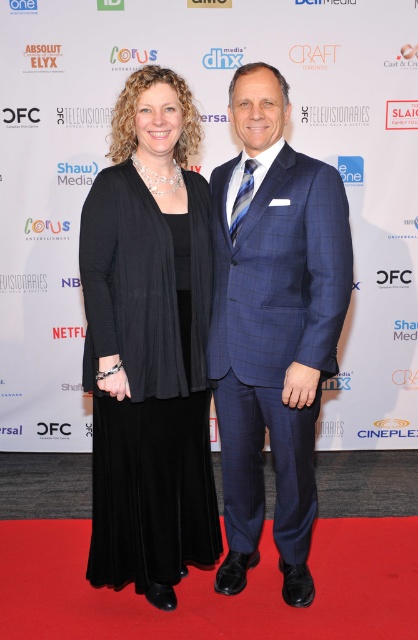
Is black matte dress at center taller than blue checkered suit at center?

Yes, black matte dress at center is taller than blue checkered suit at center.

Looking at this image, between black matte dress at center and blue checkered suit at center, which one appears on the right side from the viewer's perspective?

blue checkered suit at center

Is point (112, 353) less distant than point (318, 257)?

No, (112, 353) is behind (318, 257).

Locate an element on the screen. black matte dress at center is located at coordinates (148, 346).